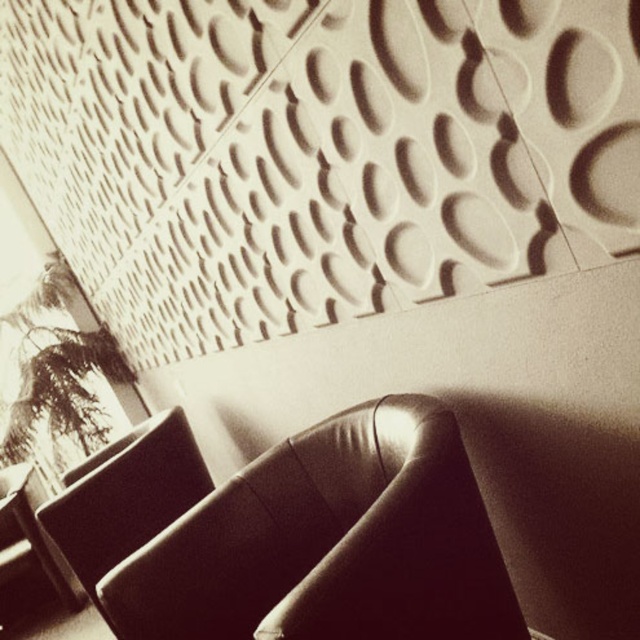
You are a guest entering the room and want to sit down. You see the leather armchair at center and the leather at left. Which one is closer to you?

The leather armchair at center is closer to you because it is in front of the leather at left.

You are an interior designer assessing the layout of the room. You need to place a new table between the leather armchair at center and the leather at left. Which object should the table be closer to if the table is 1.2 meters tall?

The table should be placed closer to the leather at left because the leather armchair at center is shorter than the leather at left, so the table height would match the taller object.

You are designing a layout for a small living room and need to place both the leather armchair at center and the leather at left. Given their widths, which one should you place closer to the textured wall to maximize space efficiency?

The leather armchair at center has a greater width than the leather at left, so placing the narrower leather at left closer to the textured wall would allow more space for the wider leather armchair at center, optimizing space usage.